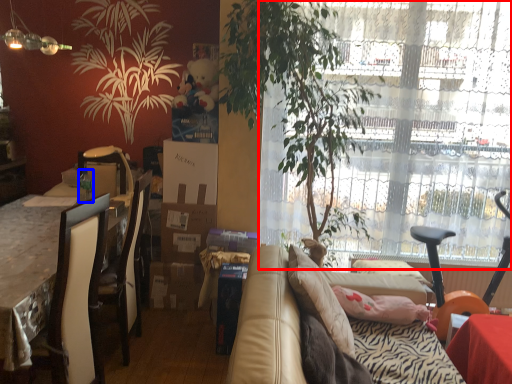
Question: Among these objects, which one is farthest to the camera, window (highlighted by a red box) or bottle (highlighted by a blue box)?

Choices:
 (A) window
 (B) bottle

Answer: (B)